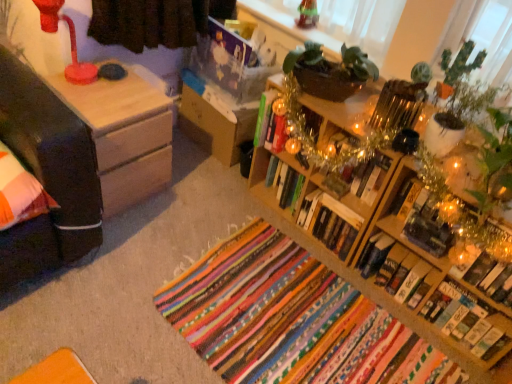
Locate an element on the screen. vacant area located to the right-hand side of wooden nightstand at left is located at coordinates (181, 199).